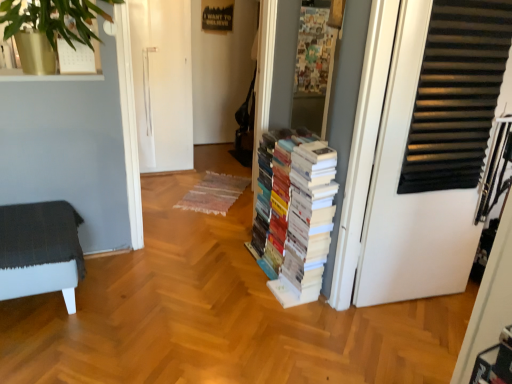
Identify the location of vacant region to the left of white paper books at center. This screenshot has height=384, width=512. (194, 279).